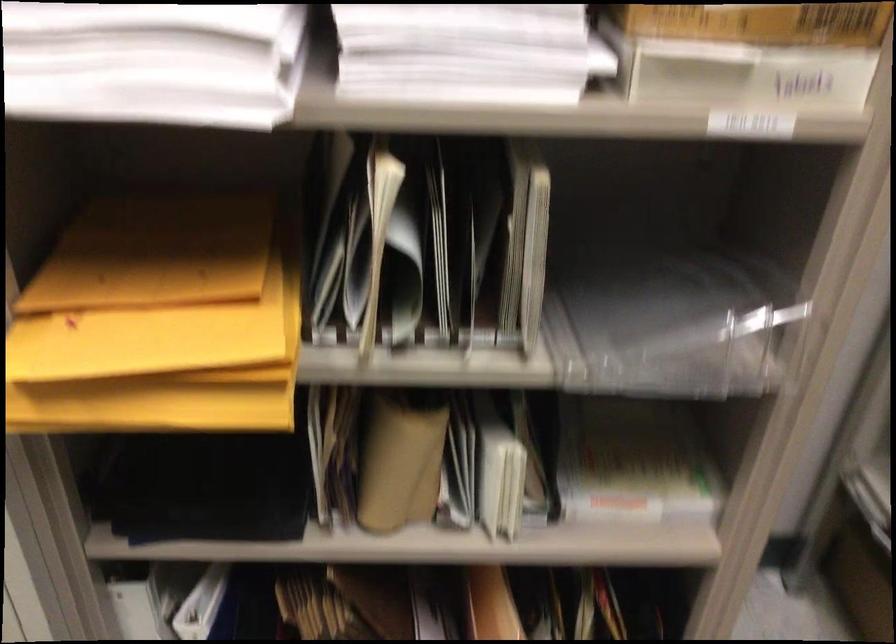
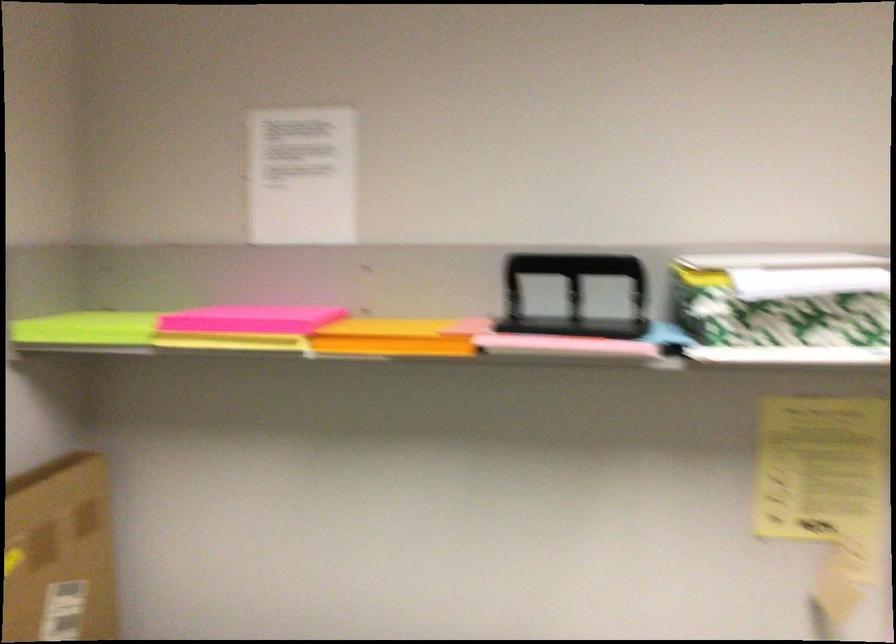
The images are taken continuously from a first-person perspective. In which direction is your viewpoint rotating?

The camera's rotation is toward right-down.